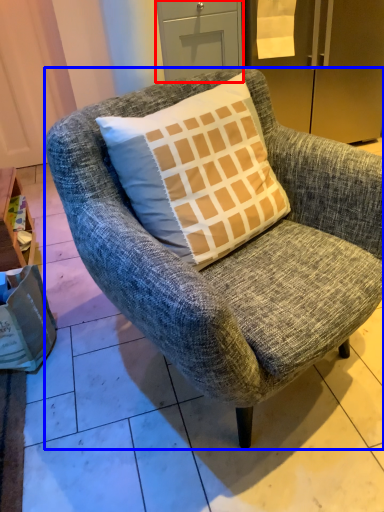
Question: Which of the following is the closest to the observer, drawer (highlighted by a red box) or chair (highlighted by a blue box)?

Choices:
 (A) drawer
 (B) chair

Answer: (B)